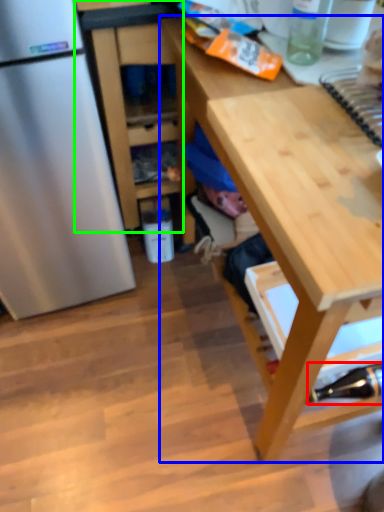
Question: Which object is the closest to the bottle (highlighted by a red box)? Choose among these: desk (highlighted by a blue box) or cabinetry (highlighted by a green box).

Choices:
 (A) desk
 (B) cabinetry

Answer: (A)